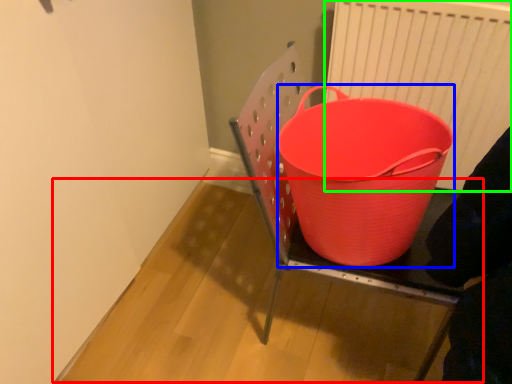
Question: Considering the real-world distances, which object is closest to table (highlighted by a red box)? basket (highlighted by a blue box) or radiator (highlighted by a green box).

Choices:
 (A) basket
 (B) radiator

Answer: (A)